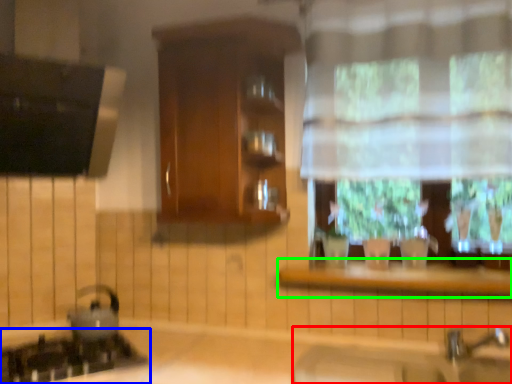
Question: Which is nearer to the sink (highlighted by a red box)? gas stove (highlighted by a blue box) or window sill (highlighted by a green box).

Choices:
 (A) gas stove
 (B) window sill

Answer: (B)